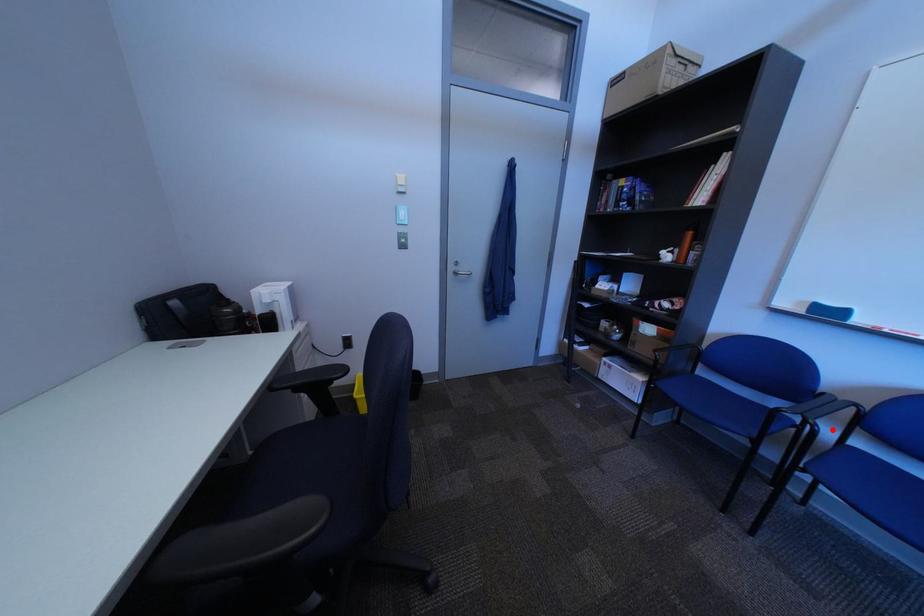
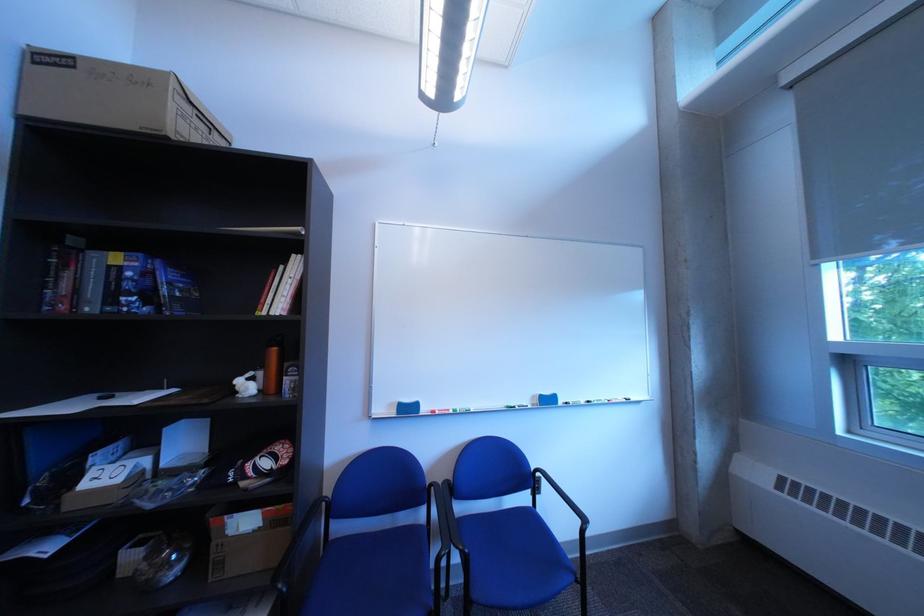
Locate, in the second image, the point that corresponds to the highlighted location in the first image.

(482, 553)